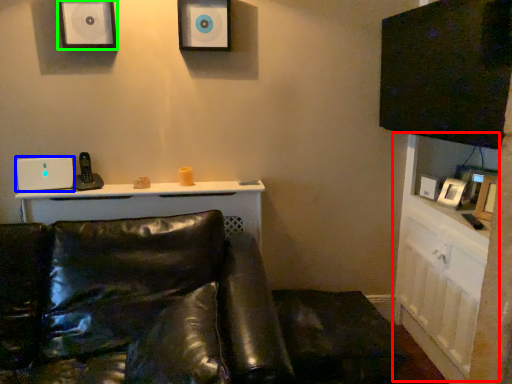
Question: Based on their relative distances, which object is nearer to dresser (highlighted by a red box)? Choose from speaker (highlighted by a blue box) and speaker (highlighted by a green box).

Choices:
 (A) speaker
 (B) speaker

Answer: (B)